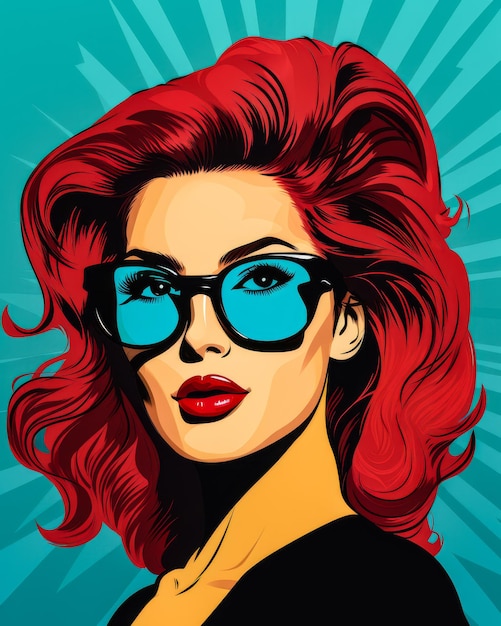
The image size is (501, 626). Find the location of `left temple of glasses`. left temple of glasses is located at coordinates (339, 277).